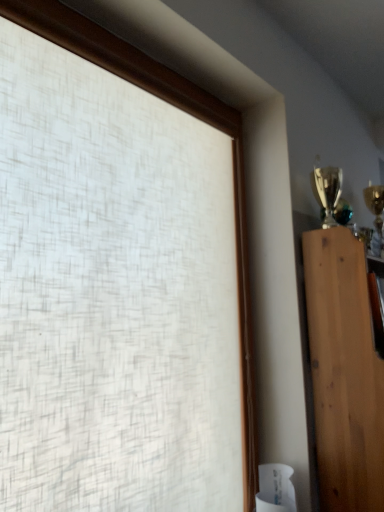
Image resolution: width=384 pixels, height=512 pixels. What do you see at coordinates (344, 372) in the screenshot? I see `natural wood board at right` at bounding box center [344, 372].

You are a GUI agent. You are given a task and a screenshot of the screen. Output one action in this format:
    pyautogui.click(x=<x>, y=<y>)
    Task: Click on the natural wood board at right
    The image size is (384, 512).
    Given the screenshot: What is the action you would take?
    pyautogui.click(x=344, y=372)

You are a GUI agent. You are given a task and a screenshot of the screen. Output one action in this format:
    pyautogui.click(x=<x>, y=<y>)
    Task: Click on the natural wood board at right
    This screenshot has height=512, width=384.
    Given the screenshot: What is the action you would take?
    pyautogui.click(x=344, y=372)